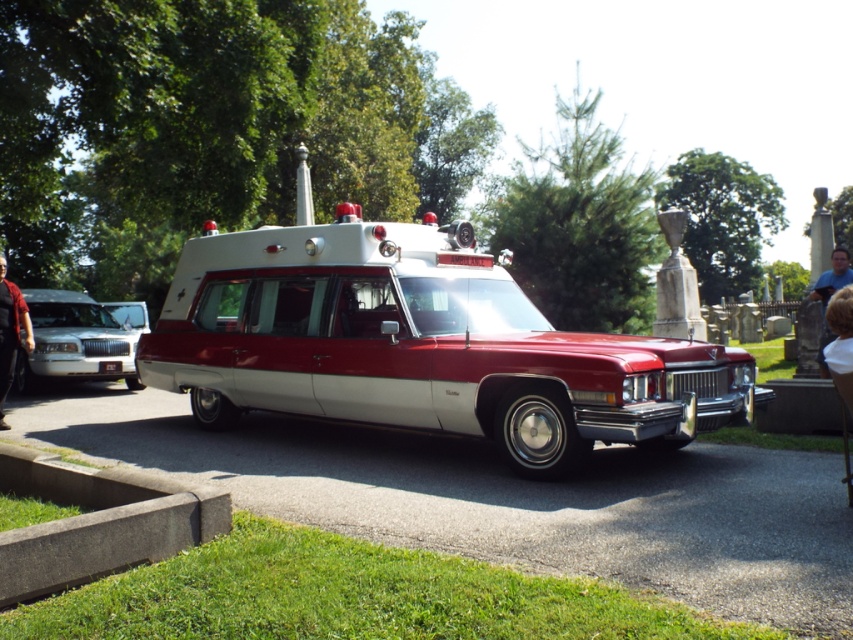
Question: In this image, where is white glossy sedan at left located relative to blue denim jeans at lower right?

Choices:
 (A) below
 (B) above

Answer: (A)

Question: Does shiny red hearse at center have a greater width compared to dark red leather jacket at left?

Choices:
 (A) yes
 (B) no

Answer: (B)

Question: Considering the real-world distances, which object is farthest from the white glossy sedan at left?

Choices:
 (A) blue denim jeans at lower right
 (B) shiny red hearse at center
 (C) dark red leather jacket at left

Answer: (A)

Question: Can you confirm if dark red leather jacket at left is bigger than blue denim jeans at lower right?

Choices:
 (A) no
 (B) yes

Answer: (A)

Question: Estimate the real-world distances between objects in this image. Which object is closer to the dark red leather jacket at left?

Choices:
 (A) white glossy sedan at left
 (B) blue denim jeans at lower right

Answer: (A)

Question: Among these objects, which one is nearest to the camera?

Choices:
 (A) white glossy sedan at left
 (B) dark red leather jacket at left
 (C) blue denim jeans at lower right
 (D) shiny red hearse at center

Answer: (B)